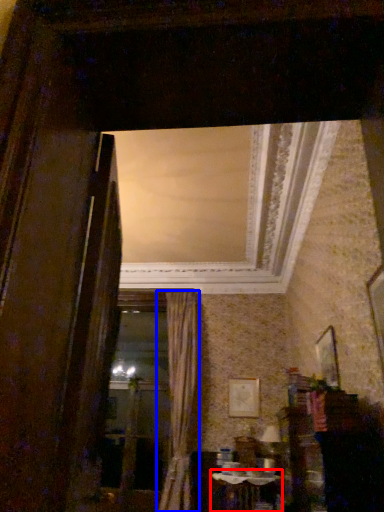
Question: Which point is further to the camera, table (highlighted by a red box) or curtain (highlighted by a blue box)?

Choices:
 (A) table
 (B) curtain

Answer: (B)